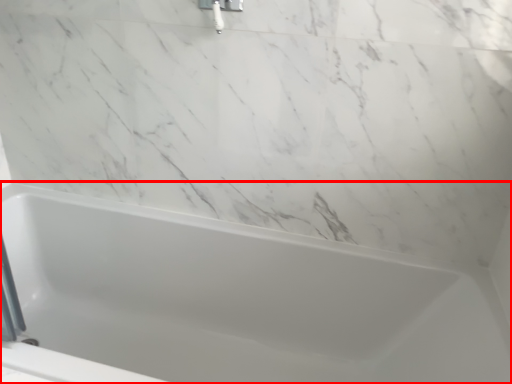
Question: Considering the relative positions of bathtub (annotated by the red box) and shower in the image provided, where is bathtub (annotated by the red box) located with respect to the staircase?

Choices:
 (A) right
 (B) left

Answer: (B)